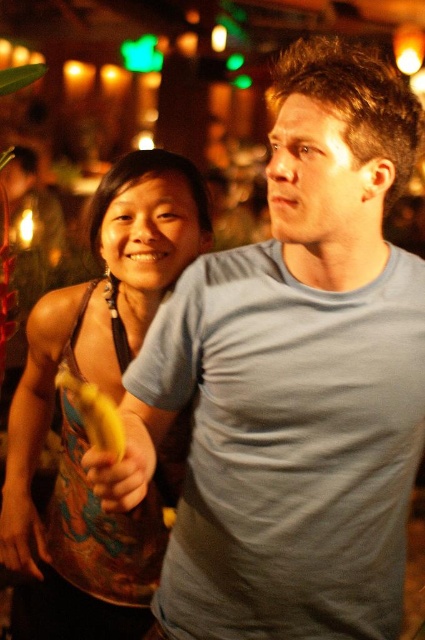
Question: Is the position of multicolored fabric dress at left more distant than that of yellow matte banana at lower left?

Choices:
 (A) yes
 (B) no

Answer: (A)

Question: Is multicolored fabric dress at left to the left of yellow matte banana at lower left from the viewer's perspective?

Choices:
 (A) yes
 (B) no

Answer: (A)

Question: Which object is farther from the camera taking this photo?

Choices:
 (A) yellow matte banana at lower left
 (B) multicolored fabric dress at left

Answer: (B)

Question: Can you confirm if multicolored fabric dress at left is positioned to the right of yellow matte banana at lower left?

Choices:
 (A) no
 (B) yes

Answer: (A)